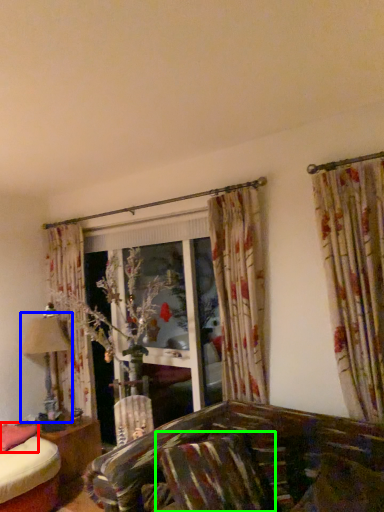
Question: Which is farther away from pillow (highlighted by a red box)? table lamp (highlighted by a blue box) or pillow (highlighted by a green box)?

Choices:
 (A) table lamp
 (B) pillow

Answer: (B)